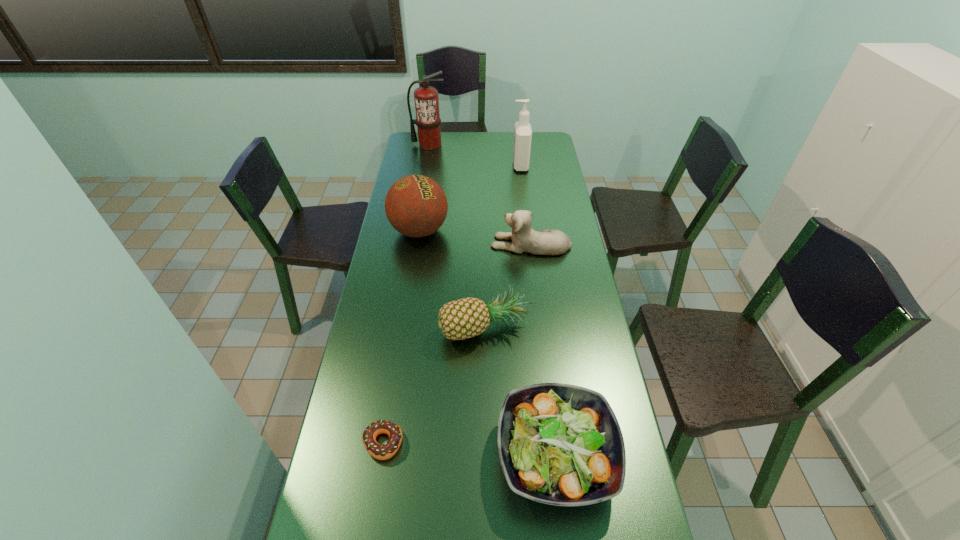
Identify the location of fire extinguisher at the left edge. The height and width of the screenshot is (540, 960). (428, 121).

Where is `basketball present at the left edge`? The image size is (960, 540). basketball present at the left edge is located at coordinates (416, 206).

At what (x,y) coordinates should I click in order to perform the action: click on doughnut that is at the left edge. Please return your answer as a coordinate pair (x, y). Looking at the image, I should click on (381, 452).

Find the location of a particular element. cleansing agent that is at the right edge is located at coordinates (522, 133).

You are a GUI agent. You are given a task and a screenshot of the screen. Output one action in this format:
    pyautogui.click(x=<x>, y=<y>)
    Task: Click on the puppy that is at the right edge
    This screenshot has height=540, width=960.
    Given the screenshot: What is the action you would take?
    pyautogui.click(x=525, y=239)

Identify the location of salad plate at the right edge. This screenshot has height=540, width=960. (559, 444).

Locate an element on the screen. Image resolution: width=960 pixels, height=540 pixels. object located at the far left corner is located at coordinates (428, 121).

In the image, there is a desktop. Where is `vacant region at the far edge`? This screenshot has height=540, width=960. vacant region at the far edge is located at coordinates (473, 139).

What are the coordinates of `blank area at the left edge` in the screenshot? It's located at (390, 291).

At what (x,y) coordinates should I click in order to perform the action: click on vacant space at the right edge. Please return your answer as a coordinate pair (x, y). Looking at the image, I should click on (565, 255).